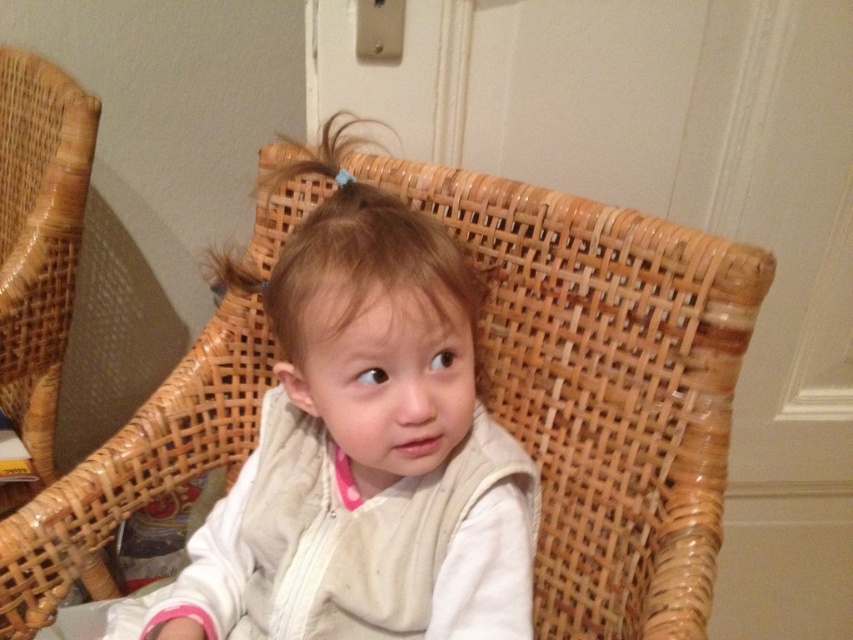
Does white cotton baby at center appear on the left side of woven wood rocking chair at left?

In fact, white cotton baby at center is to the right of woven wood rocking chair at left.

Can you confirm if white cotton baby at center is thinner than woven wood rocking chair at left?

Incorrect, white cotton baby at center's width is not less than woven wood rocking chair at left's.

I want to click on white cotton baby at center, so click(x=367, y=454).